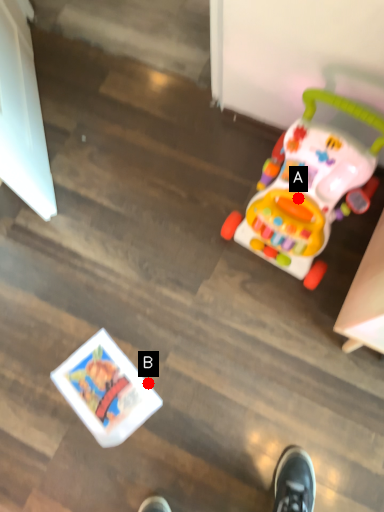
Question: Two points are circled on the image, labeled by A and B beside each circle. Which of the following is the closest to the observer?

Choices:
 (A) A is closer
 (B) B is closer

Answer: (A)